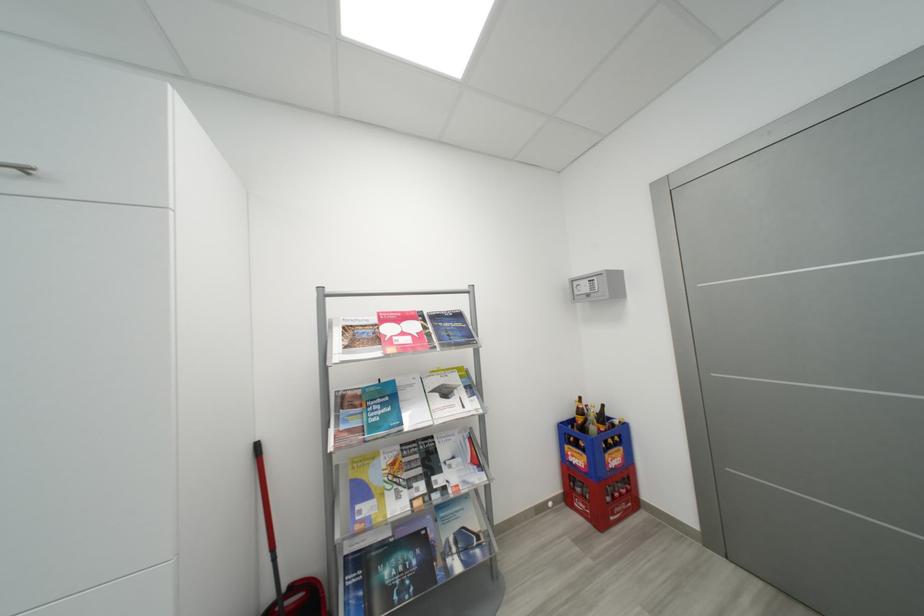
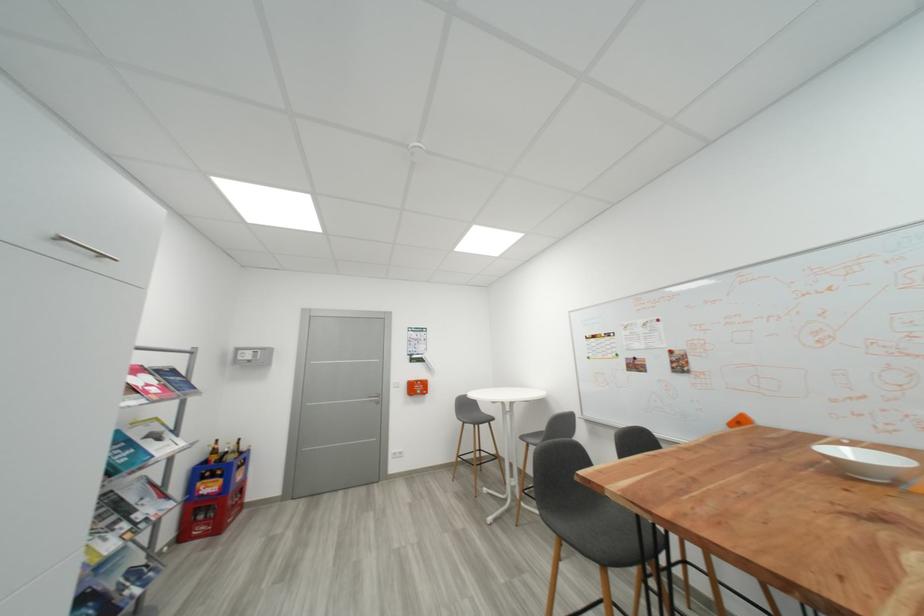
The point at (588, 413) is marked in the first image. Where is the corresponding point in the second image?

(223, 454)